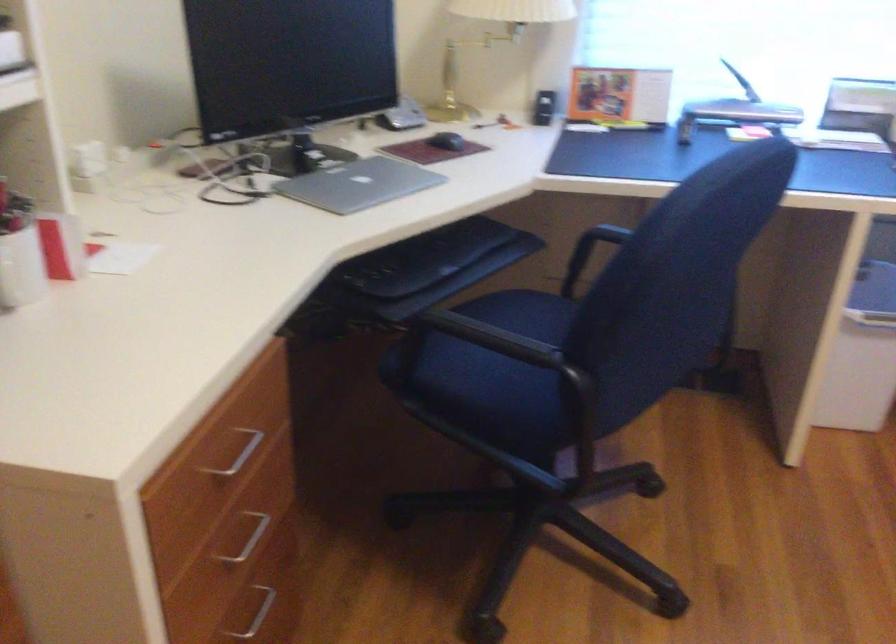
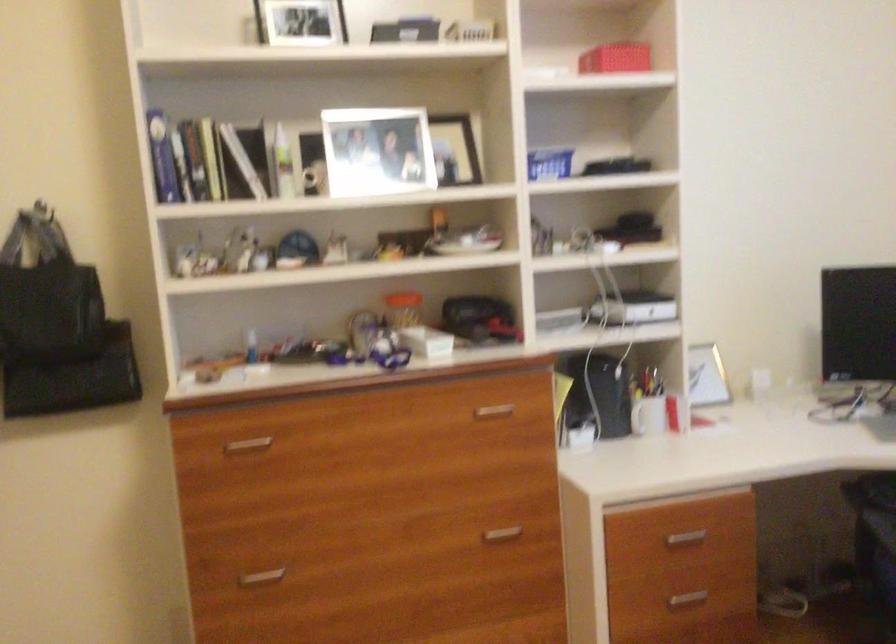
In the second image, find the point that corresponds to point (225, 468) in the first image.

(685, 538)